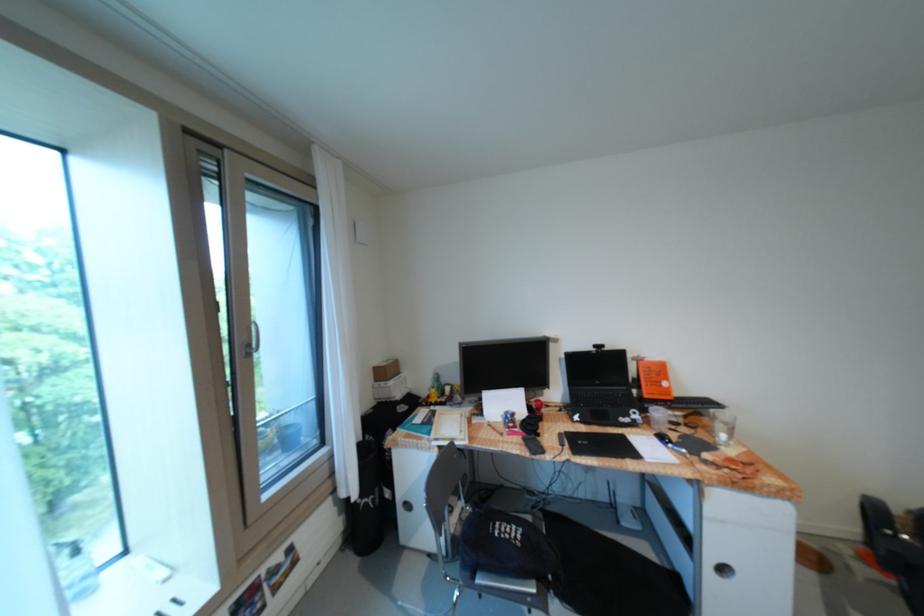
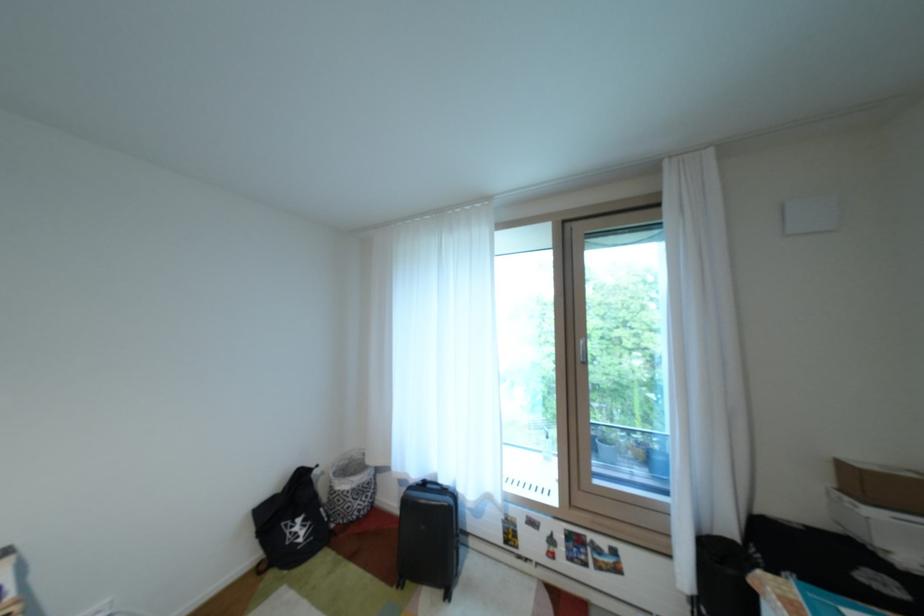
Question: The first image is from the beginning of the video and the second image is from the end. How did the camera likely rotate when shooting the video?

Choices:
 (A) Left
 (B) Right
 (C) Up
 (D) Down

Answer: (A)